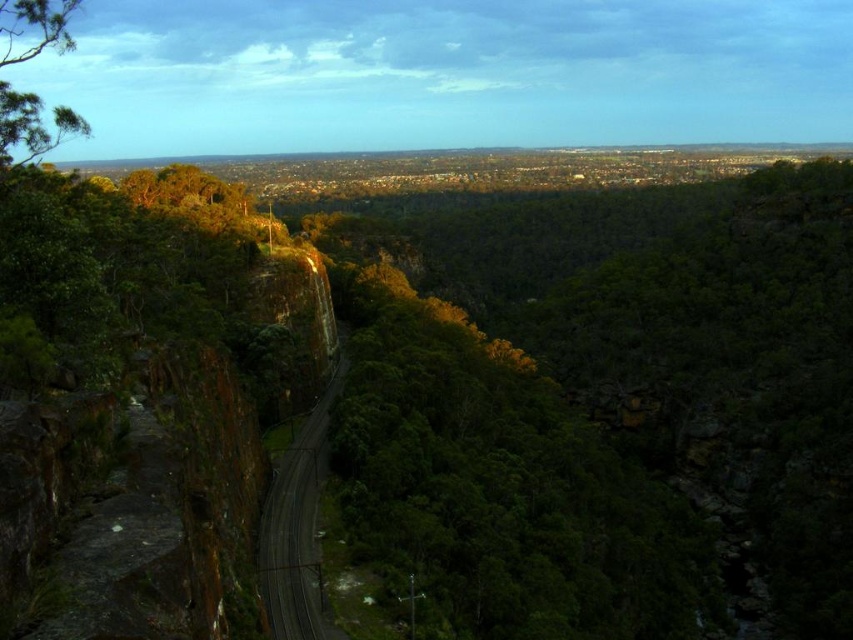
You are standing at the edge of the valley and see the green leafy tree at center and the green leafy tree at upper left. Which tree is positioned more to the right side of the valley?

The green leafy tree at center is positioned more to the right side of the valley compared to the green leafy tree at upper left.

You are a hiker standing at the base of the steep rocky cliffs on the left side of the valley. You see two trees in the distance, the green leafy tree at center and the green leafy tree at upper left. Which tree is positioned higher up in the scene?

The green leafy tree at center is positioned higher up in the scene than the green leafy tree at upper left because it is located above it.